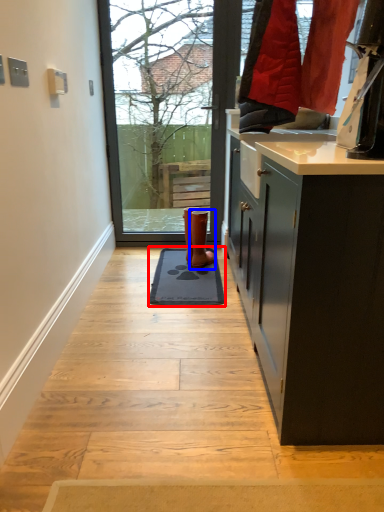
Question: Which object appears farthest to the camera in this image, doormat (highlighted by a red box) or footwear (highlighted by a blue box)?

Choices:
 (A) doormat
 (B) footwear

Answer: (B)